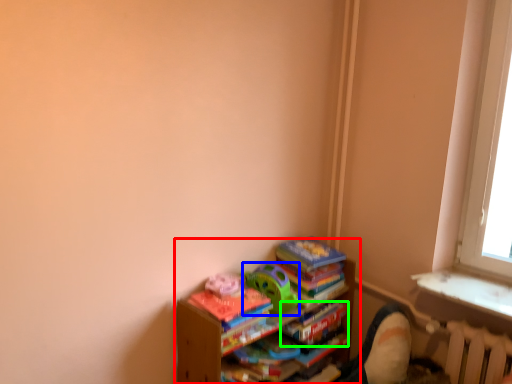
Question: Considering the real-world distances, which object is closest to shelf (highlighted by a red box)? toy (highlighted by a blue box) or paperback book (highlighted by a green box).

Choices:
 (A) toy
 (B) paperback book

Answer: (A)